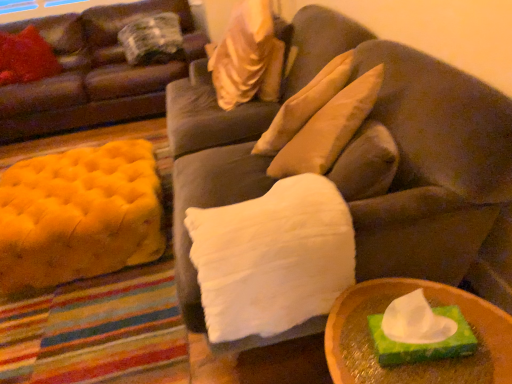
Image resolution: width=512 pixels, height=384 pixels. Identify the location of empty space that is ontop of yellow tufted ottoman at left (from a real-world perspective). (54, 177).